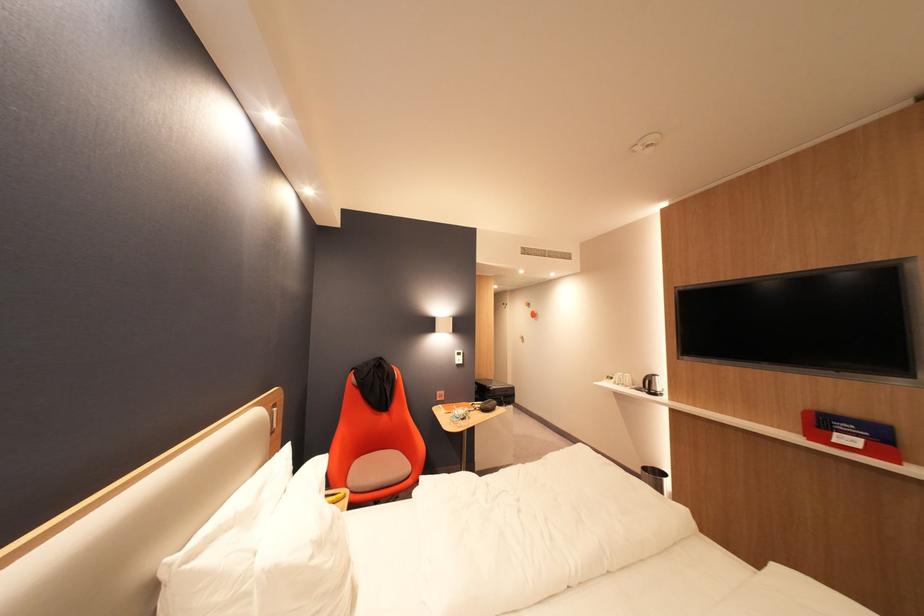
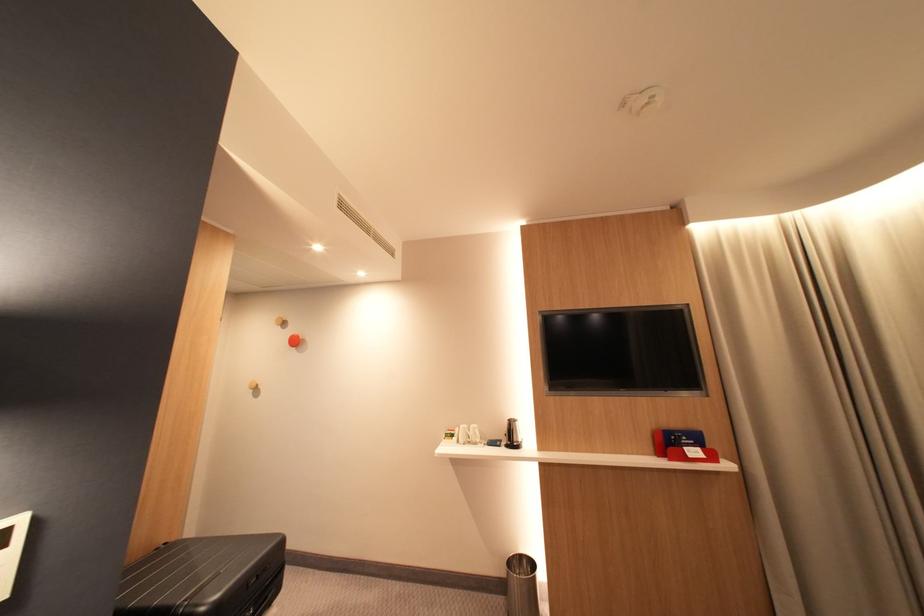
Where in the second image is the point corresponding to the point at 846,435 from the first image?

(696, 450)